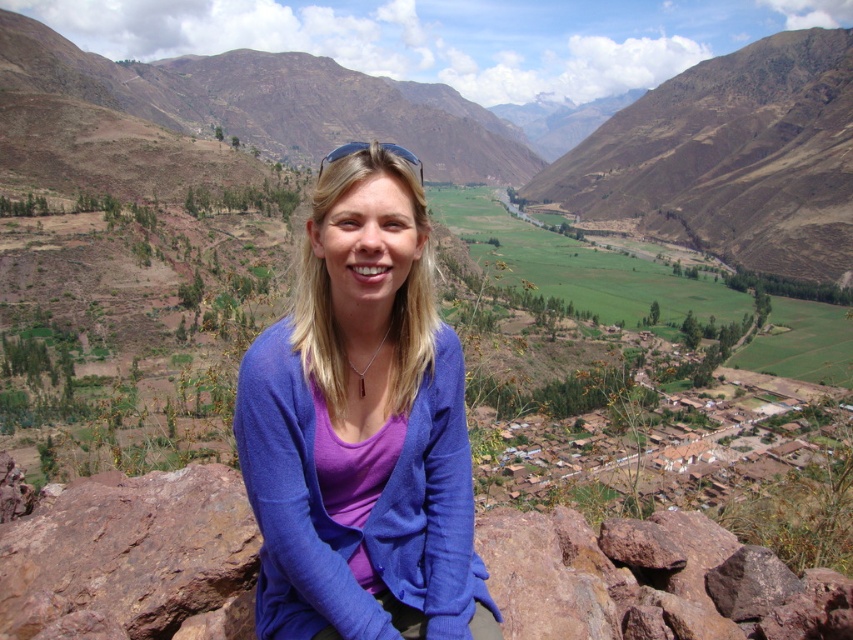
From the picture: Does purple soft sweater at center appear on the right side of rusty rock at center?

No, purple soft sweater at center is not to the right of rusty rock at center.

Does point (344, 508) come behind point (49, 579)?

No, (344, 508) is in front of (49, 579).

I want to click on purple soft sweater at center, so click(361, 429).